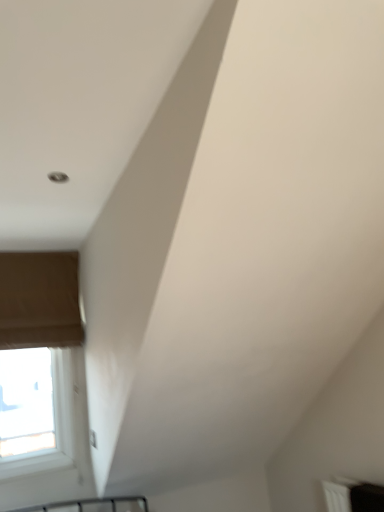
What is the approximate width of matte brown curtain at left?

The width of matte brown curtain at left is 4.08 inches.

Locate an element on the screen. The image size is (384, 512). matte brown curtain at left is located at coordinates (40, 300).

The width and height of the screenshot is (384, 512). What do you see at coordinates (40, 300) in the screenshot? I see `matte brown curtain at left` at bounding box center [40, 300].

I want to click on matte brown curtain at left, so (x=40, y=300).